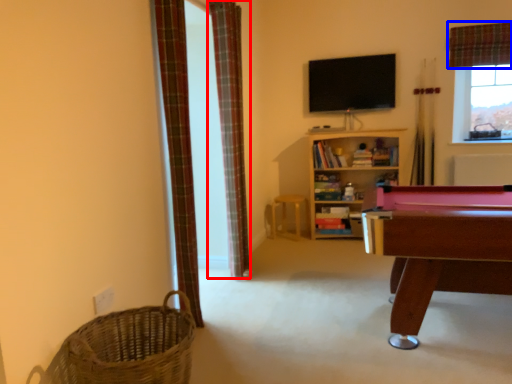
Question: Which object appears farthest to the camera in this image, curtain (highlighted by a red box) or curtain (highlighted by a blue box)?

Choices:
 (A) curtain
 (B) curtain

Answer: (B)